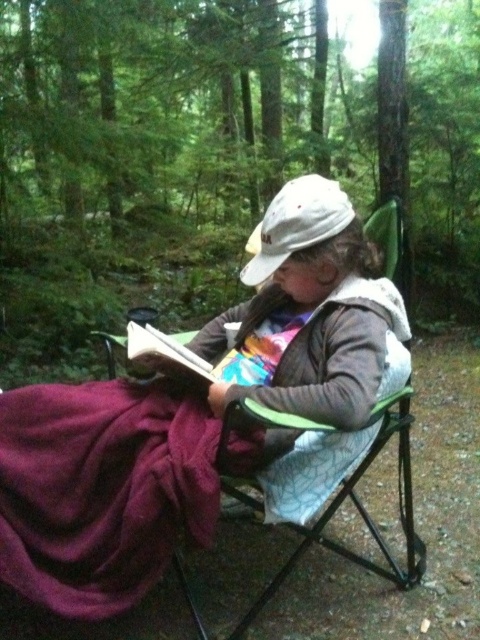
Can you confirm if green matte chair at center is shorter than white fabric cap at center?

Incorrect, green matte chair at center's height does not fall short of white fabric cap at center's.

Does green matte chair at center appear over white fabric cap at center?

Yes.

The width and height of the screenshot is (480, 640). In order to click on green matte chair at center in this screenshot , I will do `click(155, 152)`.

Is green matte chair at center to the right of maroon fleece blanket at lower left from the viewer's perspective?

In fact, green matte chair at center is to the left of maroon fleece blanket at lower left.

Is the position of green matte chair at center more distant than that of maroon fleece blanket at lower left?

Yes, it is.

At what (x,y) coordinates should I click in order to perform the action: click on green matte chair at center. Please return your answer as a coordinate pair (x, y). The height and width of the screenshot is (640, 480). Looking at the image, I should click on (155, 152).

Measure the distance between green matte chair at center and matte purple blanket at lower left.

A distance of 6.57 feet exists between green matte chair at center and matte purple blanket at lower left.

Is point (437, 81) closer to viewer compared to point (136, 540)?

No.

Where is `green matte chair at center`? This screenshot has width=480, height=640. green matte chair at center is located at coordinates (155, 152).

Where is `green matte chair at center`? green matte chair at center is located at coordinates (155, 152).